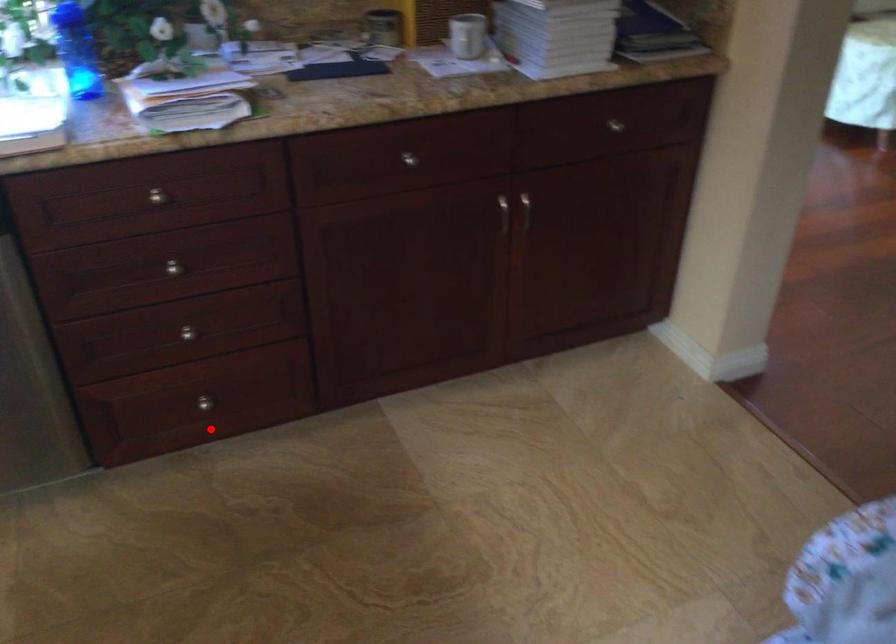
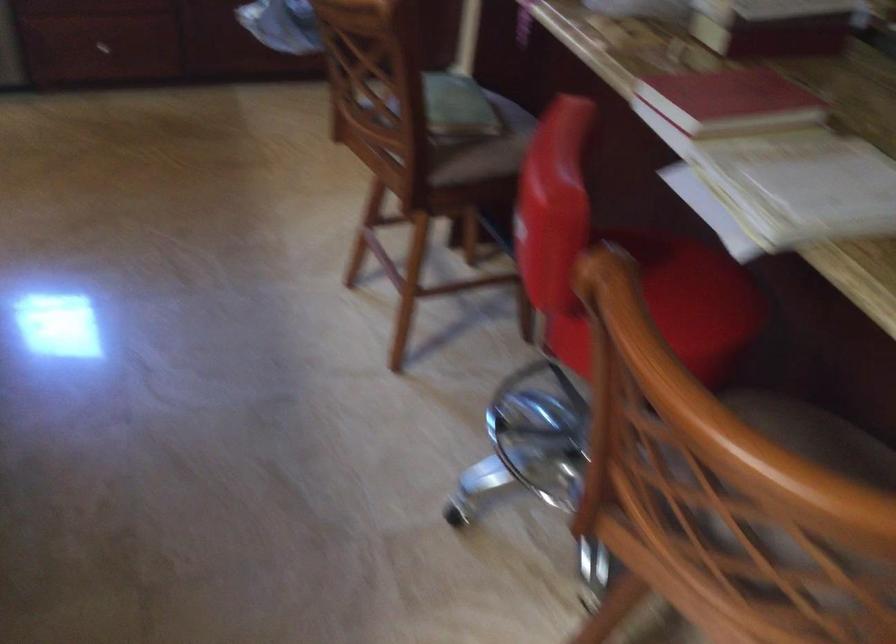
In the second image, find the point that corresponds to the highlighted location in the first image.

(98, 52)